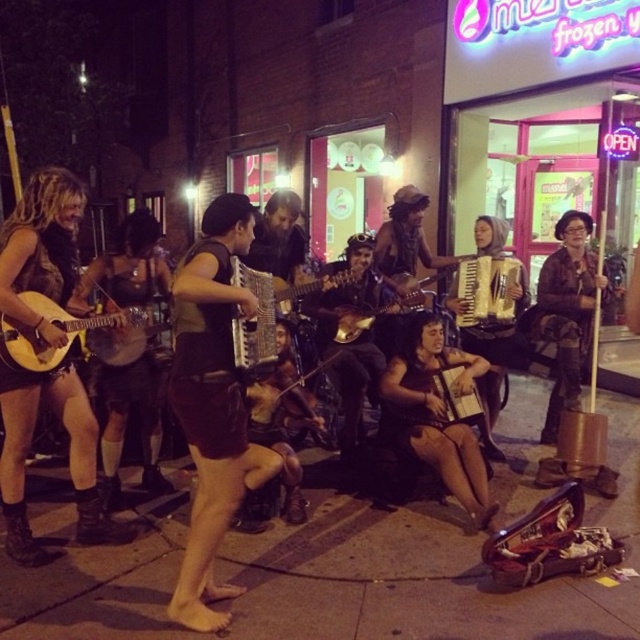
You are standing in front of the street performers and want to move closer to the point labeled as point 1. Which point, point (28, 250) or point (259, 300), is closer to you?

The point labeled as point (28, 250) is closer to you because it is further to the viewer than point (259, 300).

You are a street performer who wants to place a 1.5 meter long banner between the brown concrete pavement at center and the matte black accordion at center. Is there enough space to fit the banner without overlapping either object?

The distance between the brown concrete pavement at center and the matte black accordion at center is 1.28 meters. Since the banner is 1.5 meters long, it is longer than the available space, so it cannot be placed without overlapping either object.

What object is located at the point marked by coordinates (138, 419)?

The point marked by coordinates (138, 419) is located at the matte black skirt at center.